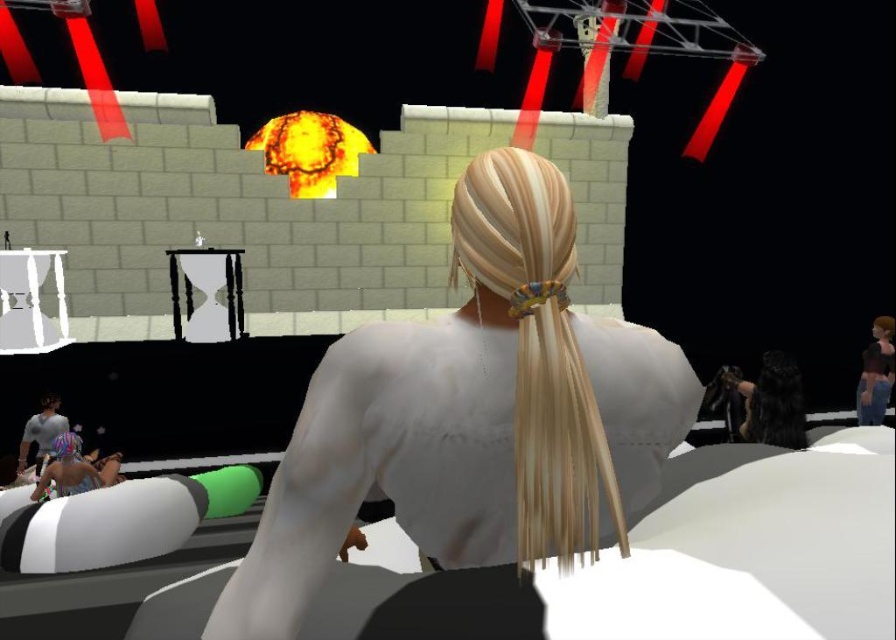
Who is more distant from viewer, (778, 403) or (93, 484)?

Point (93, 484)

Who is positioned more to the left, shiny black hair at center or matte blue swimsuit at lower left?

matte blue swimsuit at lower left

Does point (782, 404) come closer to viewer compared to point (76, 435)?

Yes, point (782, 404) is in front of point (76, 435).

Identify the location of shiny black hair at center. (774, 403).

Between blonde silky hair at center and shiny black hair at center, which one appears on the left side from the viewer's perspective?

Positioned to the left is blonde silky hair at center.

Is blonde silky hair at center above shiny black hair at center?

Correct, blonde silky hair at center is located above shiny black hair at center.

This screenshot has height=640, width=896. Find the location of `blonde silky hair at center`. blonde silky hair at center is located at coordinates (538, 349).

The height and width of the screenshot is (640, 896). I want to click on blonde silky hair at center, so click(538, 349).

From the picture: Does white matte hair at center lie in front of matte blue swimsuit at lower left?

Yes, white matte hair at center is closer to the viewer.

Is point (472, 202) behind point (71, 468)?

No, it is in front of (71, 468).

This screenshot has width=896, height=640. Identify the location of white matte hair at center. (472, 416).